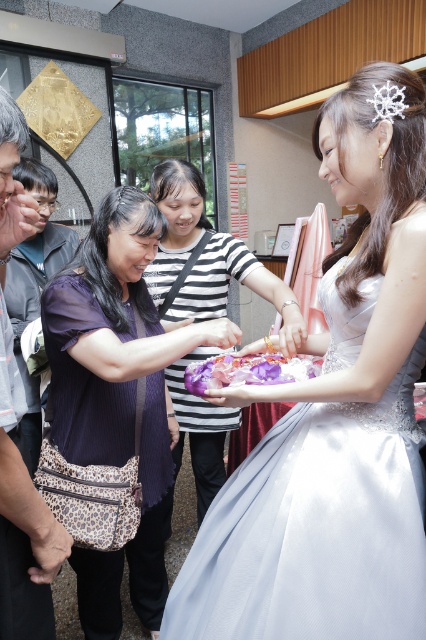
Question: Which object is the closest to the white lace tiara at upper center?

Choices:
 (A) purple sheer dress at center
 (B) satin white dress at center

Answer: (B)

Question: Is satin white dress at center below striped fabric dress at center?

Choices:
 (A) no
 (B) yes

Answer: (A)

Question: Which of these objects is positioned farthest from the striped fabric dress at center?

Choices:
 (A) purple sheer dress at center
 (B) white lace tiara at upper center
 (C) leather jacket at left

Answer: (B)

Question: Can you confirm if purple sheer dress at center is bigger than white lace tiara at upper center?

Choices:
 (A) no
 (B) yes

Answer: (B)

Question: Does satin white dress at center appear on the left side of striped fabric dress at center?

Choices:
 (A) no
 (B) yes

Answer: (A)

Question: Which object is positioned closest to the striped fabric dress at center?

Choices:
 (A) purple sheer dress at center
 (B) satin white dress at center
 (C) leather jacket at left
 (D) white lace tiara at upper center

Answer: (A)